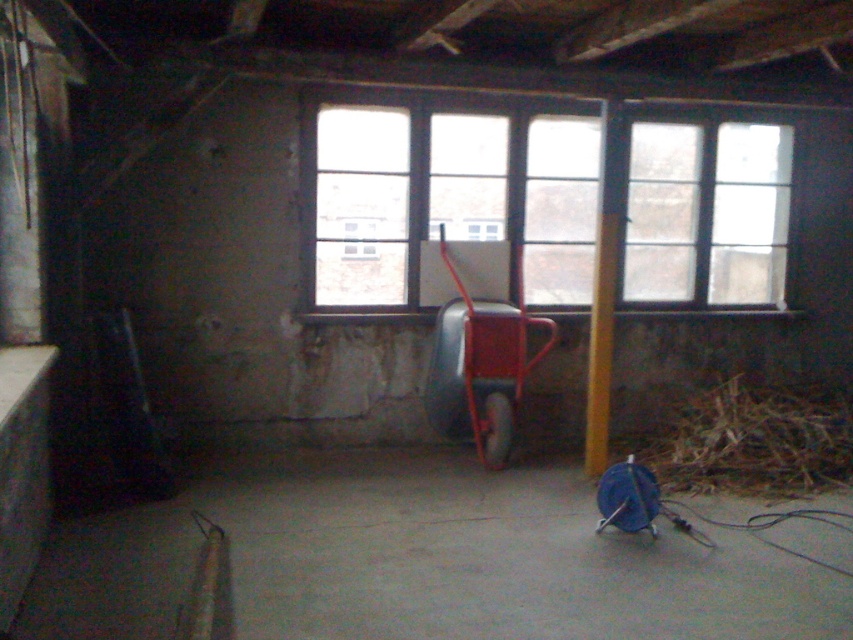
Question: Which of the following is the closest to the observer?

Choices:
 (A) (589, 392)
 (B) (469, 337)

Answer: (A)

Question: Can you confirm if blue plastic spool at center is positioned below brown dry hay at lower right?

Choices:
 (A) yes
 (B) no

Answer: (A)

Question: Is blue plastic spool at center further to camera compared to clear glass window at upper center?

Choices:
 (A) yes
 (B) no

Answer: (B)

Question: Which object is the closest to the blue plastic spool at center?

Choices:
 (A) brown dry hay at lower right
 (B) metallic red hand truck at center
 (C) clear glass window at upper center
 (D) clear glass window at center

Answer: (B)

Question: Does blue plastic spool at center come in front of yellow wood pole at center?

Choices:
 (A) no
 (B) yes

Answer: (B)

Question: Which point appears farthest from the camera in this image?

Choices:
 (A) (619, 214)
 (B) (665, 291)
 (C) (698, 237)
 (D) (532, 579)

Answer: (B)